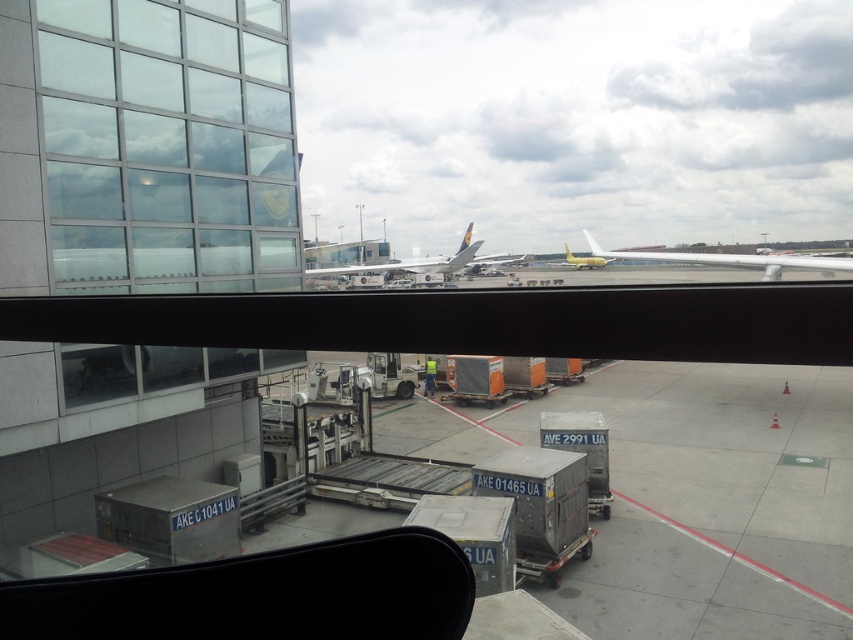
You are an airport maintenance worker standing near the terminal window. You need to inspect both the yellow matte airplane at center and the white glossy airplane at center. Which airplane should you approach first to reach the closer one?

You should approach the yellow matte airplane at center first because it is closer to you than the white glossy airplane at center, which is further away.

You are standing inside the airport terminal and want to see the yellow matte airplane at center through the transparent glass window at upper left. Can you see the airplane clearly through the window?

The transparent glass window at upper left is in front of the yellow matte airplane at center, so you can see the airplane clearly through the window.

You are an airport staff member who needs to direct a luggage cart from the terminal entrance to the correct airplane. You see the white glossy airplane at center and the gold metallic airplane at center. Which airplane should you head towards if your destination is the one on the right side?

You should head towards the gold metallic airplane at center because the white glossy airplane at center is positioned on the left side of it, meaning the gold metallic airplane at center is on the right side.